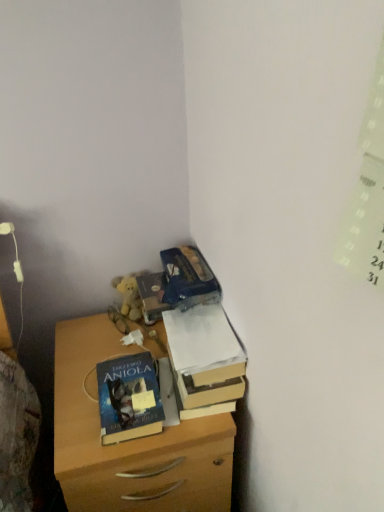
Question: From the image's perspective, is wooden chest of drawers at lower left above blue matte book at center?

Choices:
 (A) yes
 (B) no

Answer: (B)

Question: Is wooden chest of drawers at lower left thinner than blue matte book at center?

Choices:
 (A) yes
 (B) no

Answer: (B)

Question: Is wooden chest of drawers at lower left not inside blue matte book at center?

Choices:
 (A) no
 (B) yes

Answer: (B)

Question: From the image's perspective, is wooden chest of drawers at lower left beneath blue matte book at center?

Choices:
 (A) yes
 (B) no

Answer: (A)

Question: Is wooden chest of drawers at lower left to the left of blue matte book at center from the viewer's perspective?

Choices:
 (A) yes
 (B) no

Answer: (B)

Question: Is wooden chest of drawers at lower left turned away from blue matte book at center?

Choices:
 (A) no
 (B) yes

Answer: (A)

Question: From a real-world perspective, is wooden chest of drawers at lower left physically below cardboard box at upper right?

Choices:
 (A) yes
 (B) no

Answer: (A)

Question: Is wooden chest of drawers at lower left not near cardboard box at upper right?

Choices:
 (A) yes
 (B) no

Answer: (B)

Question: Considering the relative sizes of wooden chest of drawers at lower left and cardboard box at upper right in the image provided, is wooden chest of drawers at lower left shorter than cardboard box at upper right?

Choices:
 (A) no
 (B) yes

Answer: (A)

Question: Is wooden chest of drawers at lower left oriented away from cardboard box at upper right?

Choices:
 (A) yes
 (B) no

Answer: (B)

Question: Does wooden chest of drawers at lower left have a greater width compared to cardboard box at upper right?

Choices:
 (A) no
 (B) yes

Answer: (B)

Question: Is wooden chest of drawers at lower left to the left of cardboard box at upper right from the viewer's perspective?

Choices:
 (A) no
 (B) yes

Answer: (B)

Question: Is blue matte book at center positioned behind cardboard box at upper right?

Choices:
 (A) no
 (B) yes

Answer: (A)